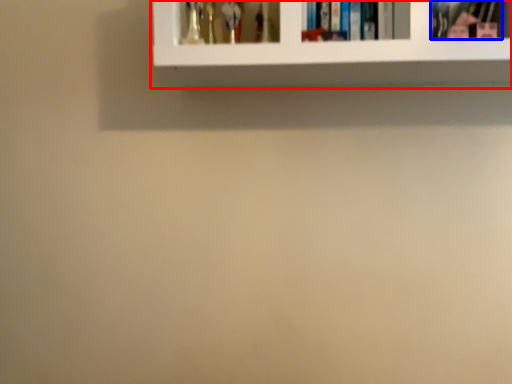
Question: Which of the following is the closest to the observer, shelf (highlighted by a red box) or book (highlighted by a blue box)?

Choices:
 (A) shelf
 (B) book

Answer: (A)